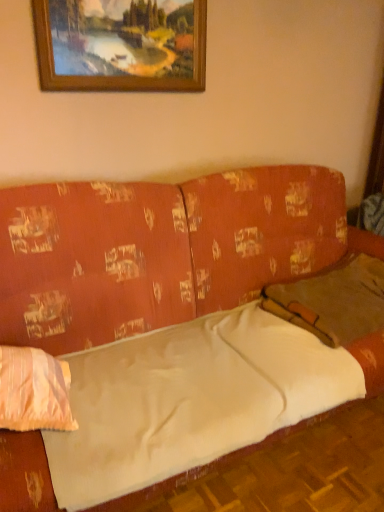
You are a GUI agent. You are given a task and a screenshot of the screen. Output one action in this format:
    pyautogui.click(x=<x>, y=<y>)
    Task: Click on the textured orange couch at center
    This screenshot has width=384, height=512.
    Given the screenshot: What is the action you would take?
    point(24,473)

I want to click on wooden picture frame at upper center, so click(x=122, y=46).

You are a GUI agent. You are given a task and a screenshot of the screen. Output one action in this format:
    pyautogui.click(x=<x>, y=<y>)
    Task: Click on the textured orange couch at center
    The width and height of the screenshot is (384, 512).
    Given the screenshot: What is the action you would take?
    pyautogui.click(x=24, y=473)

How far apart are light pink fabric pillow at left, which is counted as the 2th pillow, starting from the back, and brown fabric pillow at right, arranged as the first pillow when viewed from the back?

light pink fabric pillow at left, which is counted as the 2th pillow, starting from the back, is 1.13 meters away from brown fabric pillow at right, arranged as the first pillow when viewed from the back.

From a real-world perspective, does light pink fabric pillow at left, which is counted as the 2th pillow, starting from the back, stand above brown fabric pillow at right, arranged as the first pillow when viewed from the back?

No, from a real-world perspective, light pink fabric pillow at left, which is counted as the 2th pillow, starting from the back, is not above brown fabric pillow at right, arranged as the first pillow when viewed from the back.

Relative to brown fabric pillow at right, the 2th pillow in the left-to-right sequence, is light pink fabric pillow at left, positioned as the 2th pillow in right-to-left order, in front or behind?

light pink fabric pillow at left, positioned as the 2th pillow in right-to-left order, is in front of brown fabric pillow at right, the 2th pillow in the left-to-right sequence.

From the picture: Does light pink fabric pillow at left, placed as the 1th pillow when sorted from front to back, contain brown fabric pillow at right, the 2th pillow in the left-to-right sequence?

No, brown fabric pillow at right, the 2th pillow in the left-to-right sequence, is not a part of light pink fabric pillow at left, placed as the 1th pillow when sorted from front to back.

Considering the positions of point (1, 399) and point (42, 493), is point (1, 399) closer or farther from the camera than point (42, 493)?

Point (1, 399).

Identify the location of studio couch in front of the light pink fabric pillow at left, positioned as the 2th pillow in right-to-left order. (24, 473).

Is light pink fabric pillow at left, the first pillow from the left, oriented towards textured orange couch at center?

Yes, light pink fabric pillow at left, the first pillow from the left, is turned towards textured orange couch at center.

Can you tell me how much textured orange couch at center and brown fabric pillow at right, acting as the first pillow starting from the right, differ in facing direction?

0.32 degrees.

Does point (302, 184) come behind point (264, 298)?

Yes, point (302, 184) is farther from viewer.

Is textured orange couch at center not inside brown fabric pillow at right, acting as the first pillow starting from the right?

textured orange couch at center is positioned outside brown fabric pillow at right, acting as the first pillow starting from the right.

Is textured orange couch at center wider or thinner than brown fabric pillow at right, arranged as the first pillow when viewed from the back?

In the image, textured orange couch at center appears to be wider than brown fabric pillow at right, arranged as the first pillow when viewed from the back.

Who is bigger, wooden picture frame at upper center or light pink fabric pillow at left, the first pillow from the left?

Bigger between the two is light pink fabric pillow at left, the first pillow from the left.

Is light pink fabric pillow at left, the first pillow from the left, surrounded by wooden picture frame at upper center?

Definitely not — light pink fabric pillow at left, the first pillow from the left, is not inside wooden picture frame at upper center.

From the image's perspective, between wooden picture frame at upper center and light pink fabric pillow at left, the first pillow from the left, who is located below?

From the image's view, light pink fabric pillow at left, the first pillow from the left, is below.

Find the location of a particular element. picture frame above the light pink fabric pillow at left, which is counted as the 2th pillow, starting from the back (from a real-world perspective) is located at coordinates (122, 46).

Is wooden picture frame at upper center not within brown fabric pillow at right, arranged as the first pillow when viewed from the back?

Yes, wooden picture frame at upper center is not within brown fabric pillow at right, arranged as the first pillow when viewed from the back.

Does wooden picture frame at upper center appear on the right side of brown fabric pillow at right, acting as the first pillow starting from the right?

No, wooden picture frame at upper center is not to the right of brown fabric pillow at right, acting as the first pillow starting from the right.

Based on the photo, between wooden picture frame at upper center and brown fabric pillow at right, arranged as the 2th pillow when viewed from the front, which one is positioned behind?

Positioned behind is wooden picture frame at upper center.

Find the location of a particular element. This screenshot has width=384, height=512. picture frame on the left of brown fabric pillow at right, arranged as the 2th pillow when viewed from the front is located at coordinates (122, 46).

Could you tell me if light pink fabric pillow at left, placed as the 1th pillow when sorted from front to back, is facing wooden picture frame at upper center?

No, light pink fabric pillow at left, placed as the 1th pillow when sorted from front to back, is not turned towards wooden picture frame at upper center.

How different are the orientations of light pink fabric pillow at left, placed as the 1th pillow when sorted from front to back, and wooden picture frame at upper center in degrees?

The angular difference between light pink fabric pillow at left, placed as the 1th pillow when sorted from front to back, and wooden picture frame at upper center is 7.24 degrees.

Is light pink fabric pillow at left, the first pillow from the left, positioned behind wooden picture frame at upper center?

No, light pink fabric pillow at left, the first pillow from the left, is closer to the camera.

The image size is (384, 512). What are the coordinates of `the 2nd pillow in front when counting from the wooden picture frame at upper center` in the screenshot? It's located at tap(34, 391).

Which object is closer to the camera taking this photo, brown fabric pillow at right, acting as the first pillow starting from the right, or textured orange couch at center?

Positioned in front is textured orange couch at center.

From the image's perspective, which is above, brown fabric pillow at right, acting as the first pillow starting from the right, or textured orange couch at center?

From the image's view, brown fabric pillow at right, acting as the first pillow starting from the right, is above.

Based on the photo, is brown fabric pillow at right, arranged as the first pillow when viewed from the back, oriented towards textured orange couch at center?

Yes, brown fabric pillow at right, arranged as the first pillow when viewed from the back, is facing textured orange couch at center.

Where is `studio couch located underneath the brown fabric pillow at right, the 2th pillow in the left-to-right sequence (from a real-world perspective)`? The width and height of the screenshot is (384, 512). studio couch located underneath the brown fabric pillow at right, the 2th pillow in the left-to-right sequence (from a real-world perspective) is located at coordinates (24, 473).

Where is `pillow in front of the brown fabric pillow at right, the 2th pillow in the left-to-right sequence`? pillow in front of the brown fabric pillow at right, the 2th pillow in the left-to-right sequence is located at coordinates (34, 391).

Find the location of a particular element. pillow that is the 1st one when counting backward from the textured orange couch at center is located at coordinates (34, 391).

Estimate the real-world distances between objects in this image. Which object is closer to brown fabric pillow at right, arranged as the 2th pillow when viewed from the front, light pink fabric pillow at left, the first pillow from the left, or wooden picture frame at upper center?

The object closer to brown fabric pillow at right, arranged as the 2th pillow when viewed from the front, is light pink fabric pillow at left, the first pillow from the left.

Which object lies further to the anchor point textured orange couch at center, light pink fabric pillow at left, which is counted as the 2th pillow, starting from the back, or wooden picture frame at upper center?

light pink fabric pillow at left, which is counted as the 2th pillow, starting from the back, is positioned further to the anchor textured orange couch at center.

Which object lies further to the anchor point wooden picture frame at upper center, textured orange couch at center or brown fabric pillow at right, acting as the first pillow starting from the right?

brown fabric pillow at right, acting as the first pillow starting from the right.

Estimate the real-world distances between objects in this image. Which object is closer to light pink fabric pillow at left, which is counted as the 2th pillow, starting from the back, brown fabric pillow at right, arranged as the first pillow when viewed from the back, or wooden picture frame at upper center?

Among the two, brown fabric pillow at right, arranged as the first pillow when viewed from the back, is located nearer to light pink fabric pillow at left, which is counted as the 2th pillow, starting from the back.

Estimate the real-world distances between objects in this image. Which object is further from textured orange couch at center, wooden picture frame at upper center or light pink fabric pillow at left, which is counted as the 2th pillow, starting from the back?

Among the two, light pink fabric pillow at left, which is counted as the 2th pillow, starting from the back, is located further to textured orange couch at center.

When comparing their distances from textured orange couch at center, does light pink fabric pillow at left, placed as the 1th pillow when sorted from front to back, or brown fabric pillow at right, arranged as the 2th pillow when viewed from the front, seem closer?

brown fabric pillow at right, arranged as the 2th pillow when viewed from the front, is closer to textured orange couch at center.

Estimate the real-world distances between objects in this image. Which object is further from light pink fabric pillow at left, the first pillow from the left, textured orange couch at center or brown fabric pillow at right, acting as the first pillow starting from the right?

Among the two, brown fabric pillow at right, acting as the first pillow starting from the right, is located further to light pink fabric pillow at left, the first pillow from the left.

Looking at this image, looking at the image, which one is located closer to brown fabric pillow at right, arranged as the first pillow when viewed from the back, textured orange couch at center or light pink fabric pillow at left, which is counted as the 2th pillow, starting from the back?

Among the two, textured orange couch at center is located nearer to brown fabric pillow at right, arranged as the first pillow when viewed from the back.

This screenshot has height=512, width=384. Find the location of `studio couch that lies between wooden picture frame at upper center and light pink fabric pillow at left, which is counted as the 2th pillow, starting from the back, from top to bottom`. studio couch that lies between wooden picture frame at upper center and light pink fabric pillow at left, which is counted as the 2th pillow, starting from the back, from top to bottom is located at coordinates (24, 473).

I want to click on pillow between wooden picture frame at upper center and light pink fabric pillow at left, positioned as the 2th pillow in right-to-left order, from top to bottom, so click(x=333, y=300).

This screenshot has height=512, width=384. Identify the location of pillow between wooden picture frame at upper center and textured orange couch at center from top to bottom. 333,300.

Identify the location of studio couch situated between light pink fabric pillow at left, the first pillow from the left, and brown fabric pillow at right, arranged as the first pillow when viewed from the back, from left to right. This screenshot has height=512, width=384. (24, 473).